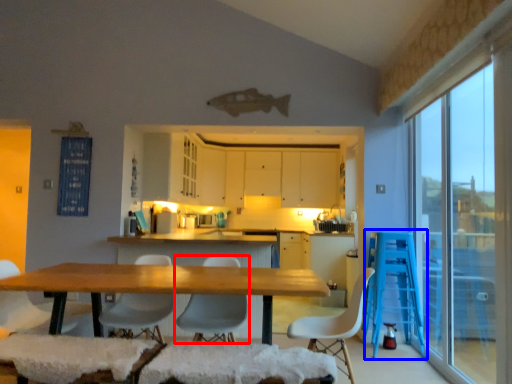
Question: Which object appears closest to the camera in this image, chair (highlighted by a red box) or bar stool (highlighted by a blue box)?

Choices:
 (A) chair
 (B) bar stool

Answer: (A)